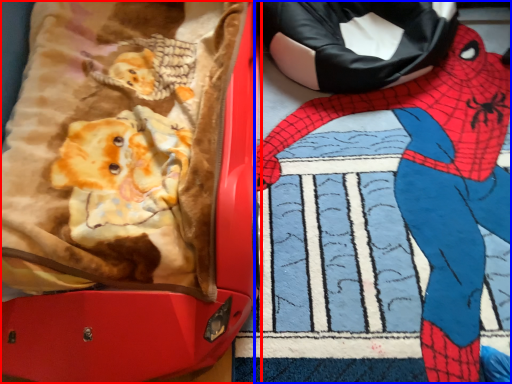
Question: Which of the following is the closest to the observer, suitcase (highlighted by a red box) or person (highlighted by a blue box)?

Choices:
 (A) suitcase
 (B) person

Answer: (A)